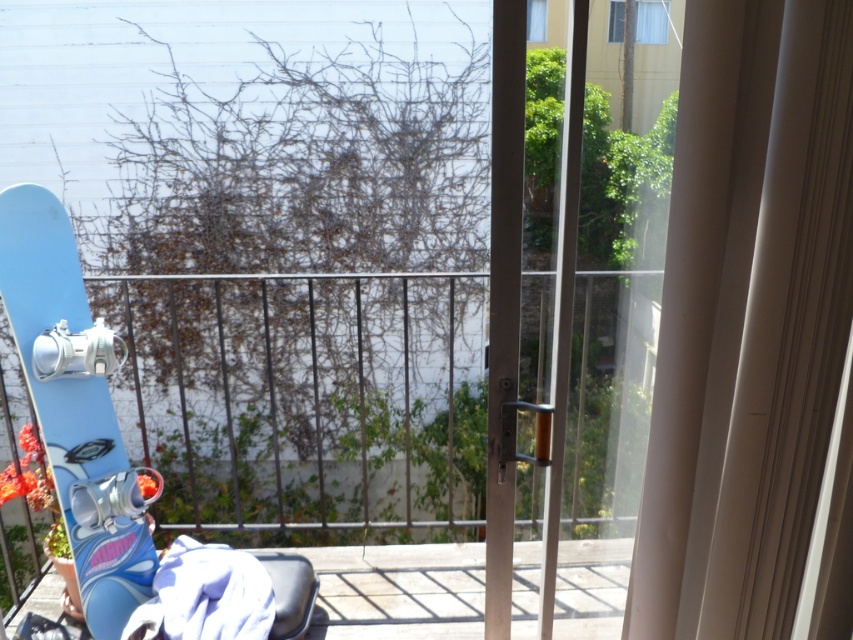
Question: In this image, where is blue glossy snowboard at left located relative to transparent glass door at center?

Choices:
 (A) above
 (B) below

Answer: (B)

Question: Where is blue glossy snowboard at left located in relation to transparent glass door at center in the image?

Choices:
 (A) left
 (B) right

Answer: (A)

Question: Which point appears closest to the camera in this image?

Choices:
 (A) (238, 493)
 (B) (96, 330)

Answer: (B)

Question: Estimate the real-world distances between objects in this image. Which object is closer to the light blue matte snowboard at left?

Choices:
 (A) transparent glass door at center
 (B) blue glossy snowboard at left

Answer: (B)

Question: Which object is closer to the camera taking this photo?

Choices:
 (A) light blue matte snowboard at left
 (B) blue glossy snowboard at left
 (C) transparent glass door at center

Answer: (C)

Question: Can you confirm if transparent glass door at center is positioned to the right of light blue matte snowboard at left?

Choices:
 (A) no
 (B) yes

Answer: (B)